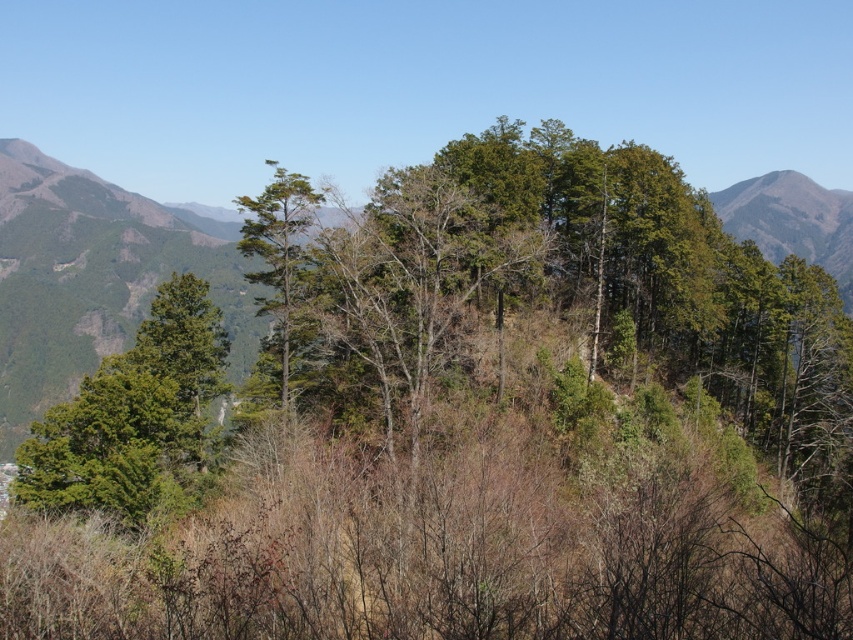
Question: Is green matte tree at left to the left of green matte tree at center from the viewer's perspective?

Choices:
 (A) yes
 (B) no

Answer: (A)

Question: Which of the following is the farthest from the observer?

Choices:
 (A) green matte tree at left
 (B) green leafy trees at upper left

Answer: (B)

Question: Considering the real-world distances, which object is closest to the green matte tree at left?

Choices:
 (A) green leafy trees at upper left
 (B) green matte tree at center

Answer: (B)

Question: Can you confirm if green matte tree at left is thinner than green matte tree at center?

Choices:
 (A) no
 (B) yes

Answer: (B)

Question: Which point is closer to the camera taking this photo?

Choices:
 (A) (279, 280)
 (B) (180, 458)

Answer: (B)

Question: In this image, where is green leafy trees at upper left located relative to green matte tree at left?

Choices:
 (A) above
 (B) below

Answer: (A)